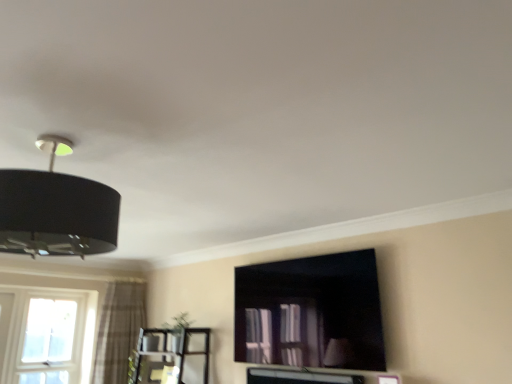
From the picture: What is the approximate width of plaid fabric curtain at left?

plaid fabric curtain at left is 11.72 inches in width.

This screenshot has height=384, width=512. Describe the element at coordinates (46, 338) in the screenshot. I see `clear glass window at lower left` at that location.

At what (x,y) coordinates should I click in order to perform the action: click on plaid fabric curtain at left. Please return your answer as a coordinate pair (x, y). This screenshot has height=384, width=512. Looking at the image, I should click on (119, 331).

Considering the relative sizes of clear glass window at lower left and matte black tv cabinet at center in the image provided, is clear glass window at lower left smaller than matte black tv cabinet at center?

Correct, clear glass window at lower left occupies less space than matte black tv cabinet at center.

From the picture: Is clear glass window at lower left next to matte black tv cabinet at center?

No, clear glass window at lower left is not touching matte black tv cabinet at center.

From a real-world perspective, relative to matte black tv cabinet at center, is clear glass window at lower left vertically above or below?

clear glass window at lower left is situated lower than matte black tv cabinet at center in the real world.

Is clear glass window at lower left to the right of matte black tv cabinet at center from the viewer's perspective?

Incorrect, clear glass window at lower left is not on the right side of matte black tv cabinet at center.

Is clear glass window at lower left turned away from black matte lampshade at upper left?

No.

Is clear glass window at lower left in front of black matte lampshade at upper left?

No, clear glass window at lower left is behind black matte lampshade at upper left.

There is a clear glass window at lower left. What are the coordinates of `lamp above it (from a real-world perspective)` in the screenshot? It's located at (56, 210).

Considering the sizes of clear glass window at lower left and black matte lampshade at upper left in the image, is clear glass window at lower left wider or thinner than black matte lampshade at upper left?

clear glass window at lower left is thinner than black matte lampshade at upper left.

How many degrees apart are the facing directions of metallic silver entertainment center at lower left and plaid fabric curtain at left?

90.3 degrees.

This screenshot has width=512, height=384. I want to click on entertainment center below the plaid fabric curtain at left (from the image's perspective), so click(x=168, y=355).

Based on their positions, is metallic silver entertainment center at lower left located to the left or right of plaid fabric curtain at left?

metallic silver entertainment center at lower left is to the right of plaid fabric curtain at left.

Is metallic silver entertainment center at lower left positioned with its back to plaid fabric curtain at left?

metallic silver entertainment center at lower left is not turned away from plaid fabric curtain at left.

Considering their positions, is black matte lampshade at upper left located in front of or behind plaid fabric curtain at left?

In the image, black matte lampshade at upper left appears in front of plaid fabric curtain at left.

Would you consider black matte lampshade at upper left to be distant from plaid fabric curtain at left?

Yes.

From a real-world perspective, who is located lower, black matte lampshade at upper left or plaid fabric curtain at left?

plaid fabric curtain at left, from a real-world perspective.

In terms of size, does black matte lampshade at upper left appear bigger or smaller than plaid fabric curtain at left?

black matte lampshade at upper left is smaller than plaid fabric curtain at left.

Is plaid fabric curtain at left further to the viewer compared to metallic silver entertainment center at lower left?

Yes, plaid fabric curtain at left is behind metallic silver entertainment center at lower left.

From a real-world perspective, is plaid fabric curtain at left located beneath metallic silver entertainment center at lower left?

Actually, plaid fabric curtain at left is physically above metallic silver entertainment center at lower left in the real world.

Is plaid fabric curtain at left positioned with its back to metallic silver entertainment center at lower left?

plaid fabric curtain at left is not turned away from metallic silver entertainment center at lower left.

Is plaid fabric curtain at left thinner than metallic silver entertainment center at lower left?

Yes, plaid fabric curtain at left is thinner than metallic silver entertainment center at lower left.

Identify the location of entertainment center on the left of black matte lampshade at upper left. (168, 355).

Considering the relative positions of black matte lampshade at upper left and metallic silver entertainment center at lower left in the image provided, is black matte lampshade at upper left to the left or to the right of metallic silver entertainment center at lower left?

In the image, black matte lampshade at upper left appears on the right side of metallic silver entertainment center at lower left.

From a real-world perspective, is black matte lampshade at upper left beneath metallic silver entertainment center at lower left?

No, from a real-world perspective, black matte lampshade at upper left is not below metallic silver entertainment center at lower left.

Is black matte lampshade at upper left closer to camera compared to metallic silver entertainment center at lower left?

That is True.

Based on the photo, from a real-world perspective, between metallic silver entertainment center at lower left and clear glass window at lower left, who is vertically lower?

metallic silver entertainment center at lower left.

Is metallic silver entertainment center at lower left surrounding clear glass window at lower left?

No.

Image resolution: width=512 pixels, height=384 pixels. Find the location of `entertainment center in front of the clear glass window at lower left`. entertainment center in front of the clear glass window at lower left is located at coordinates (168, 355).

Is the surface of metallic silver entertainment center at lower left in direct contact with clear glass window at lower left?

No, metallic silver entertainment center at lower left is not beside clear glass window at lower left.

In order to click on tv cabinet located above the clear glass window at lower left (from the image's perspective) in this screenshot , I will do `click(311, 311)`.

The width and height of the screenshot is (512, 384). Find the location of `window located behind the black matte lampshade at upper left`. window located behind the black matte lampshade at upper left is located at coordinates (46, 338).

Based on their spatial positions, is metallic silver entertainment center at lower left or matte black tv cabinet at center further from clear glass window at lower left?

matte black tv cabinet at center lies further to clear glass window at lower left than the other object.

When comparing their distances from matte black tv cabinet at center, does black matte lampshade at upper left or plaid fabric curtain at left seem closer?

The object closer to matte black tv cabinet at center is black matte lampshade at upper left.

Based on the photo, considering their positions, is black matte lampshade at upper left positioned further to metallic silver entertainment center at lower left than clear glass window at lower left?

Among the two, black matte lampshade at upper left is located further to metallic silver entertainment center at lower left.

When comparing their distances from metallic silver entertainment center at lower left, does clear glass window at lower left or black matte lampshade at upper left seem further?

Among the two, black matte lampshade at upper left is located further to metallic silver entertainment center at lower left.

Considering their positions, is metallic silver entertainment center at lower left positioned closer to matte black tv cabinet at center than plaid fabric curtain at left?

metallic silver entertainment center at lower left.

Based on the photo, estimate the real-world distances between objects in this image. Which object is further from clear glass window at lower left, matte black tv cabinet at center or plaid fabric curtain at left?

matte black tv cabinet at center lies further to clear glass window at lower left than the other object.

Looking at the image, which one is located further to clear glass window at lower left, black matte lampshade at upper left or matte black tv cabinet at center?

black matte lampshade at upper left is positioned further to the anchor clear glass window at lower left.

Looking at the image, which one is located further to black matte lampshade at upper left, clear glass window at lower left or metallic silver entertainment center at lower left?

clear glass window at lower left lies further to black matte lampshade at upper left than the other object.

What are the coordinates of `entertainment center between clear glass window at lower left and matte black tv cabinet at center` in the screenshot? It's located at (168, 355).

The width and height of the screenshot is (512, 384). I want to click on curtain located between clear glass window at lower left and matte black tv cabinet at center in the left-right direction, so click(119, 331).

The width and height of the screenshot is (512, 384). I want to click on entertainment center located between plaid fabric curtain at left and matte black tv cabinet at center in the left-right direction, so click(x=168, y=355).

You are a GUI agent. You are given a task and a screenshot of the screen. Output one action in this format:
    pyautogui.click(x=<x>, y=<y>)
    Task: Click on the curtain located between clear glass window at lower left and metallic silver entertainment center at lower left in the left-right direction
    The height and width of the screenshot is (384, 512).
    Given the screenshot: What is the action you would take?
    pyautogui.click(x=119, y=331)